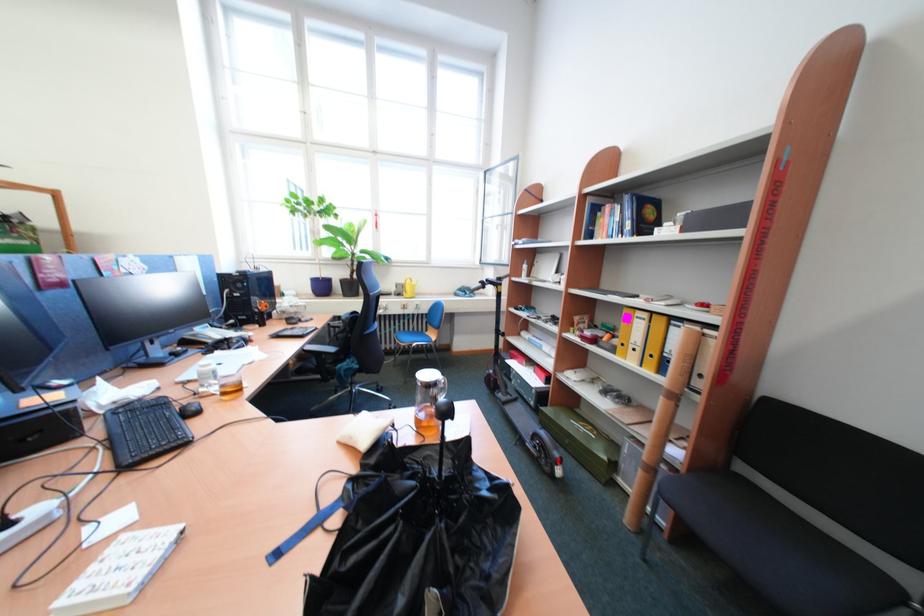
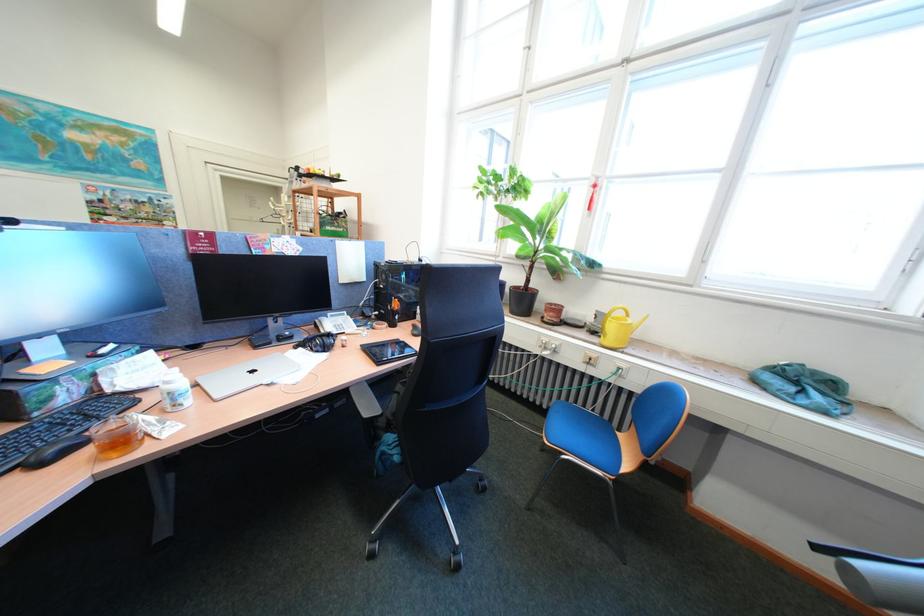
Question: I am providing you with two images of the same scene from different viewpoints. Please identify which objects are invisible in image2.

Choices:
 (A) black chair armrest
 (B) white pill bottle
 (C) black headphones
 (D) none of these

Answer: (D)